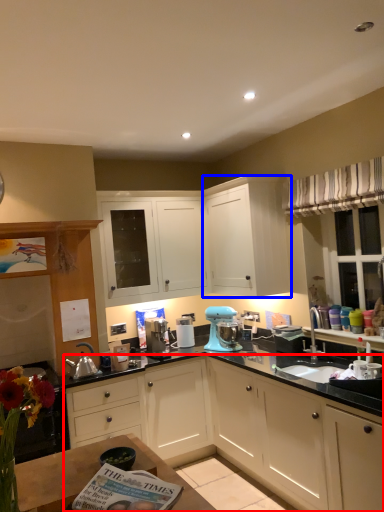
Question: Among these objects, which one is nearest to the camera, cabinetry (highlighted by a red box) or cabinetry (highlighted by a blue box)?

Choices:
 (A) cabinetry
 (B) cabinetry

Answer: (A)